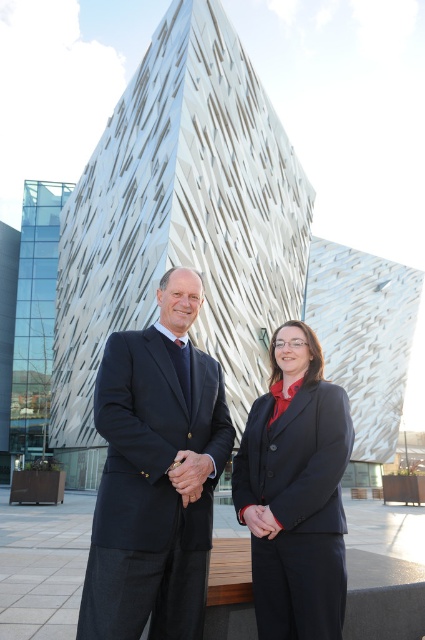
Based on the photo, is matte black suit at center thinner than dark blue wool suit at center?

No.

What are the coordinates of `matte black suit at center` in the screenshot? It's located at (295, 492).

Where is `matte black suit at center`? This screenshot has height=640, width=425. matte black suit at center is located at coordinates (295, 492).

Which is more to the right, matte black suit at center or matte black blazer at center?

Positioned to the right is matte black blazer at center.

Is matte black suit at center to the right of matte black blazer at center from the viewer's perspective?

In fact, matte black suit at center is to the left of matte black blazer at center.

Is point (240, 496) closer to viewer compared to point (272, 508)?

No, it is not.

You are a GUI agent. You are given a task and a screenshot of the screen. Output one action in this format:
    pyautogui.click(x=<x>, y=<y>)
    Task: Click on the matte black suit at center
    The height and width of the screenshot is (640, 425).
    Given the screenshot: What is the action you would take?
    pyautogui.click(x=295, y=492)

Does dark blue wool suit at center appear on the right side of matte black blazer at center?

In fact, dark blue wool suit at center is to the left of matte black blazer at center.

Is point (172, 365) farther from viewer compared to point (306, 429)?

Yes, point (172, 365) is behind point (306, 429).

Image resolution: width=425 pixels, height=640 pixels. In order to click on dark blue wool suit at center in this screenshot , I will do `click(152, 490)`.